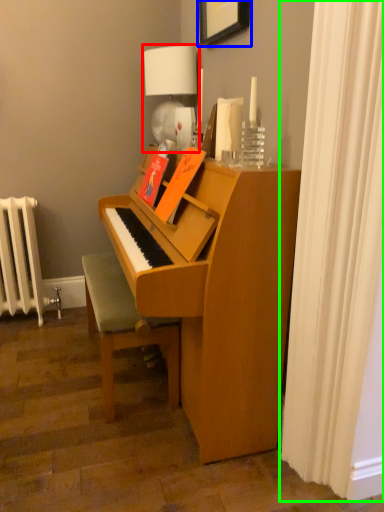
Question: Which object is positioned closest to table lamp (highlighted by a red box)? Select from picture frame (highlighted by a blue box) and shower curtain (highlighted by a green box).

Choices:
 (A) picture frame
 (B) shower curtain

Answer: (A)